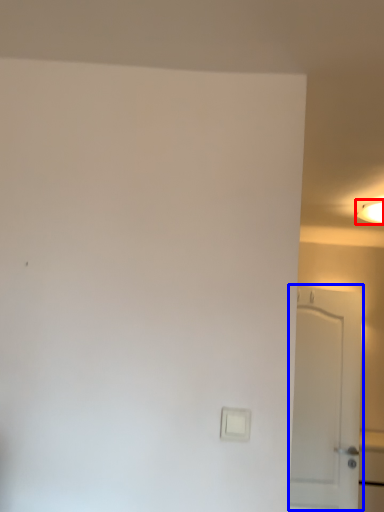
Question: Among these objects, which one is nearest to the camera, lighting (highlighted by a red box) or door (highlighted by a blue box)?

Choices:
 (A) lighting
 (B) door

Answer: (B)